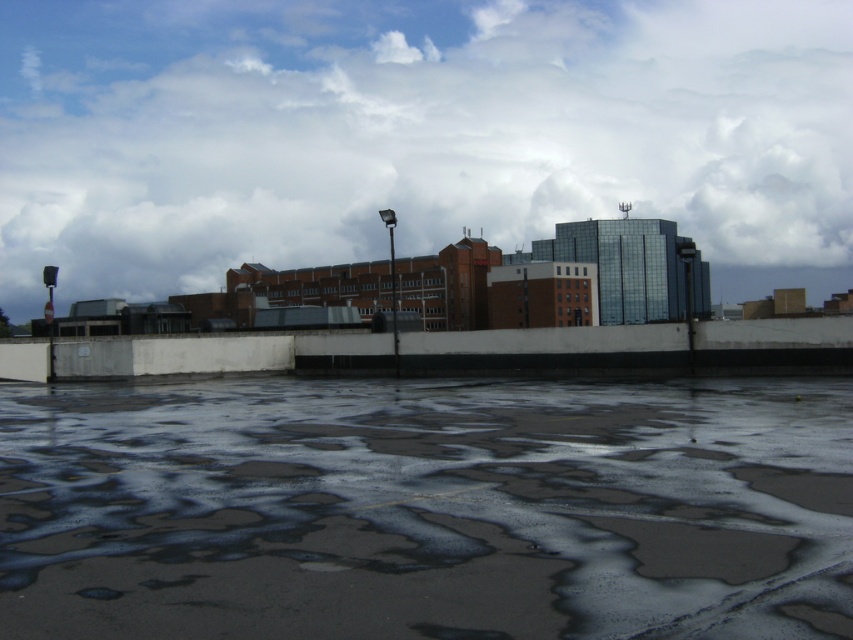
Question: Can you confirm if white fluffy cloud at upper center is positioned to the left of dark concrete flood at lower center?

Choices:
 (A) yes
 (B) no

Answer: (B)

Question: Which point appears farthest from the camera in this image?

Choices:
 (A) (529, 124)
 (B) (236, 484)

Answer: (A)

Question: Considering the relative positions of white fluffy cloud at upper center and dark concrete flood at lower center in the image provided, where is white fluffy cloud at upper center located with respect to dark concrete flood at lower center?

Choices:
 (A) left
 (B) right

Answer: (B)

Question: Which point is closer to the camera?

Choices:
 (A) (125, 228)
 (B) (381, 420)

Answer: (B)

Question: Does white fluffy cloud at upper center appear on the right side of dark concrete flood at lower center?

Choices:
 (A) no
 (B) yes

Answer: (B)